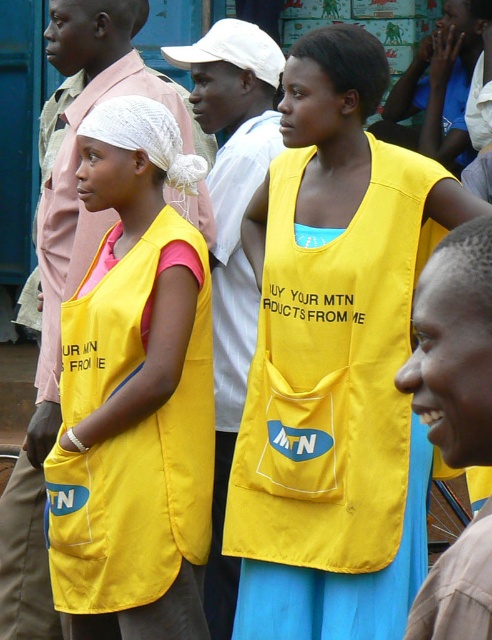
Does yellow fabric vest at center come behind matte yellow vest at center?

No, it is in front of matte yellow vest at center.

Does yellow fabric vest at center appear on the left side of matte yellow vest at center?

Incorrect, yellow fabric vest at center is not on the left side of matte yellow vest at center.

Between point (312, 538) and point (181, 260), which one is positioned in front?

Point (312, 538) is more forward.

Find the location of `yellow fabric vest at center`. yellow fabric vest at center is located at coordinates (334, 360).